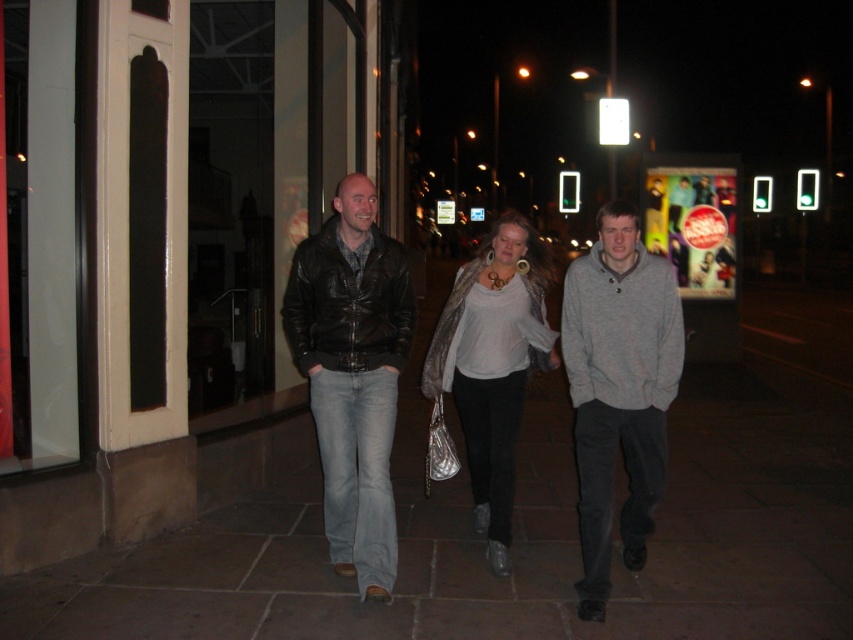
Is leather jacket at center bigger than silver metallic jacket at center?

Yes.

Does leather jacket at center have a smaller size compared to silver metallic jacket at center?

No.

Does point (461, 298) lie behind point (479, 340)?

Yes.

This screenshot has width=853, height=640. What are the coordinates of `leather jacket at center` in the screenshot? It's located at (492, 364).

Who is shorter, gray cotton hoodie at center or silver metallic jacket at center?

Standing shorter between the two is silver metallic jacket at center.

Does gray cotton hoodie at center lie in front of silver metallic jacket at center?

Yes, gray cotton hoodie at center is in front of silver metallic jacket at center.

Describe the element at coordinates (618, 388) in the screenshot. I see `gray cotton hoodie at center` at that location.

Find the location of a particular element. gray cotton hoodie at center is located at coordinates (618, 388).

Can you confirm if gray cotton hoodie at center is positioned below black leather jacket at center?

Indeed, gray cotton hoodie at center is positioned under black leather jacket at center.

Is gray cotton hoodie at center taller than black leather jacket at center?

Yes.

Is point (605, 356) positioned behind point (404, 314)?

That is False.

I want to click on gray cotton hoodie at center, so click(x=618, y=388).